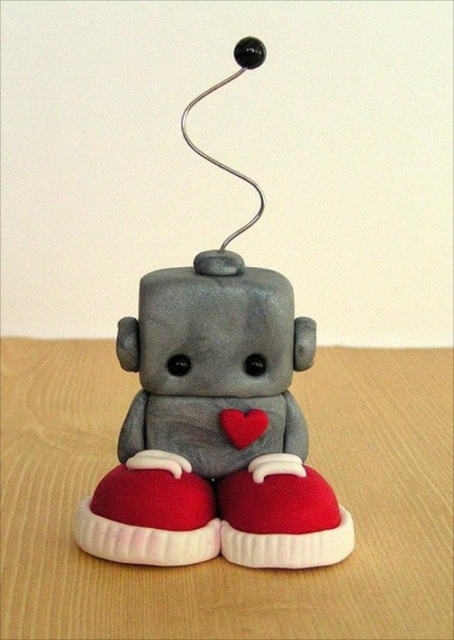
Is wooden table at center to the left of red matte shoe at lower center from the viewer's perspective?

In fact, wooden table at center is to the right of red matte shoe at lower center.

Is wooden table at center below red matte shoe at lower center?

No.

Between point (39, 348) and point (78, 531), which one is positioned in front?

Positioned in front is point (78, 531).

Where is `wooden table at center`? Image resolution: width=454 pixels, height=640 pixels. wooden table at center is located at coordinates (221, 557).

Who is positioned more to the right, matte gray robot at center or red matte shoe at lower center?

matte gray robot at center

Is point (162, 545) more distant than point (167, 476)?

No, it is in front of (167, 476).

Is point (208, 456) more distant than point (171, 557)?

Yes, point (208, 456) is behind point (171, 557).

Locate an element on the screen. The width and height of the screenshot is (454, 640). matte gray robot at center is located at coordinates (215, 419).

Does matte gray robot at center appear on the right side of matte red shoe at lower center?

Incorrect, matte gray robot at center is not on the right side of matte red shoe at lower center.

Is point (211, 323) farther from camera compared to point (351, 538)?

That is True.

You are a GUI agent. You are given a task and a screenshot of the screen. Output one action in this format:
    pyautogui.click(x=<x>, y=<y>)
    Task: Click on the matte gray robot at center
    The width and height of the screenshot is (454, 640).
    Given the screenshot: What is the action you would take?
    pyautogui.click(x=215, y=419)